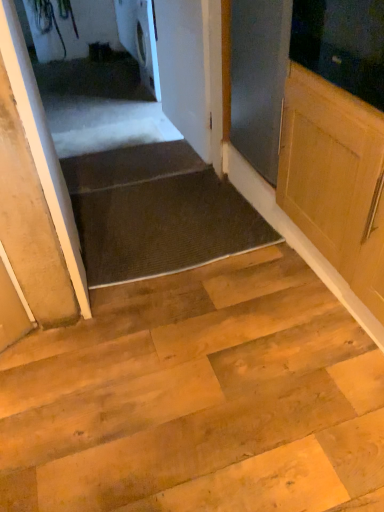
Find the location of a particular element. This screenshot has width=384, height=512. white glossy washing machine at upper center is located at coordinates (140, 39).

This screenshot has height=512, width=384. What do you see at coordinates (185, 69) in the screenshot?
I see `white matte door at upper center, the 2th door in the left-to-right sequence` at bounding box center [185, 69].

Measure the distance between point (120, 199) and camera.

Point (120, 199) is 8.02 feet from camera.

Find the location of `white glossy washing machine at upper center`. white glossy washing machine at upper center is located at coordinates [140, 39].

In the scene shown: Which is closer to the camera, (x=173, y=103) or (x=104, y=169)?

The point (x=104, y=169) is closer.

Between white matte door at upper center, the 2th door in the left-to-right sequence, and dark brown carpet at lower center, which one appears on the right side from the viewer's perspective?

From the viewer's perspective, white matte door at upper center, the 2th door in the left-to-right sequence, appears more on the right side.

Looking at this image, is white matte door at upper center, the 2th door in the left-to-right sequence, in contact with dark brown carpet at lower center?

No, white matte door at upper center, the 2th door in the left-to-right sequence, is not beside dark brown carpet at lower center.

From a real-world perspective, which is physically above, white matte door at upper center, the 2th door in the left-to-right sequence, or dark brown carpet at lower center?

white matte door at upper center, the 2th door in the left-to-right sequence, is physically above.

From the image's perspective, between dark gray textured mat at center and white matte door at left, acting as the 1th door starting from the front, which one is located above?

From the image's view, white matte door at left, acting as the 1th door starting from the front, is above.

Between dark gray textured mat at center and white matte door at left, which is the 1th door in left-to-right order, which one has larger width?

white matte door at left, which is the 1th door in left-to-right order.

From a real-world perspective, is dark gray textured mat at center on white matte door at left, acting as the 1th door starting from the front?

No, from a real-world perspective, dark gray textured mat at center is not above white matte door at left, acting as the 1th door starting from the front.

Is white glossy washing machine at upper center aimed at white matte door at upper center, which is the first door in right-to-left order?

No, white glossy washing machine at upper center does not turn towards white matte door at upper center, which is the first door in right-to-left order.

At what (x,y) coordinates should I click in order to perform the action: click on the 1st door directly above the white glossy washing machine at upper center (from a real-world perspective). Please return your answer as a coordinate pair (x, y). Looking at the image, I should click on (185, 69).

Considering the sizes of objects white glossy washing machine at upper center and white matte door at upper center, the first door positioned from the back, in the image provided, who is smaller, white glossy washing machine at upper center or white matte door at upper center, the first door positioned from the back,?

white matte door at upper center, the first door positioned from the back, is smaller.

Is point (119, 17) positioned behind point (159, 3)?

Yes, point (119, 17) is farther from viewer.

Which object is further away from the camera taking this photo, white matte door at upper center, which is the first door in right-to-left order, or white matte door at left, which is the 1th door in left-to-right order?

Positioned behind is white matte door at upper center, which is the first door in right-to-left order.

Which is more to the right, white matte door at upper center, the first door positioned from the back, or white matte door at left, positioned as the second door in back-to-front order?

From the viewer's perspective, white matte door at upper center, the first door positioned from the back, appears more on the right side.

What's the angular difference between white matte door at upper center, the first door positioned from the back, and white matte door at left, positioned as the second door in back-to-front order,'s facing directions?

The angular difference between white matte door at upper center, the first door positioned from the back, and white matte door at left, positioned as the second door in back-to-front order, is 85.6 degrees.

From the picture: How much distance is there between white matte door at upper center, which is the first door in right-to-left order, and white matte door at left, acting as the 1th door starting from the front?

white matte door at upper center, which is the first door in right-to-left order, and white matte door at left, acting as the 1th door starting from the front, are 1.33 meters apart.

Which object is positioned more to the right, white glossy washing machine at upper center or dark brown carpet at lower center?

white glossy washing machine at upper center is more to the right.

Consider the image. From the image's perspective, is white glossy washing machine at upper center above or below dark brown carpet at lower center?

From the image's perspective, white glossy washing machine at upper center appears above dark brown carpet at lower center.

Is white glossy washing machine at upper center inside or outside of dark brown carpet at lower center?

white glossy washing machine at upper center is spatially situated outside dark brown carpet at lower center.

From a real-world perspective, is white glossy washing machine at upper center physically below dark brown carpet at lower center?

No, from a real-world perspective, white glossy washing machine at upper center is not under dark brown carpet at lower center.

Which of these two, white matte door at left, acting as the 1th door starting from the front, or white glossy washing machine at upper center, is smaller?

With smaller size is white matte door at left, acting as the 1th door starting from the front.

In the image, there is a white matte door at left, the 2th door positioned from the right. Where is `appliance below it (from a real-world perspective)`? This screenshot has height=512, width=384. appliance below it (from a real-world perspective) is located at coordinates (140, 39).

From the picture: From a real-world perspective, which is physically below, white matte door at left, positioned as the second door in back-to-front order, or white glossy washing machine at upper center?

From a 3D spatial view, white glossy washing machine at upper center is below.

Considering the relative sizes of white matte door at left, positioned as the second door in back-to-front order, and white glossy washing machine at upper center in the image provided, is white matte door at left, positioned as the second door in back-to-front order, wider than white glossy washing machine at upper center?

Correct, the width of white matte door at left, positioned as the second door in back-to-front order, exceeds that of white glossy washing machine at upper center.

Based on their positions, is white matte door at left, which is the 1th door in left-to-right order, located to the left or right of dark gray textured mat at center?

white matte door at left, which is the 1th door in left-to-right order, is positioned on dark gray textured mat at center's left side.

From a real-world perspective, which door is the 2nd one above the dark gray textured mat at center? Please provide its 2D coordinates.

[(35, 191)]

From the picture: Is white matte door at left, acting as the 1th door starting from the front, in front of or behind dark gray textured mat at center in the image?

white matte door at left, acting as the 1th door starting from the front, is positioned closer to the viewer than dark gray textured mat at center.

At what (x,y) coordinates should I click in order to perform the action: click on the 1st door in front of the dark brown carpet at lower center, starting your count from the anchor. Please return your answer as a coordinate pair (x, y). This screenshot has width=384, height=512. Looking at the image, I should click on (185, 69).

Find the location of `stairwell behind the white matte door at left, the 2th door positioned from the right`. stairwell behind the white matte door at left, the 2th door positioned from the right is located at coordinates (156, 212).

Based on their spatial positions, is dark brown carpet at lower center or white glossy washing machine at upper center further from white matte door at left, positioned as the second door in back-to-front order?

white glossy washing machine at upper center lies further to white matte door at left, positioned as the second door in back-to-front order, than the other object.

From the image, which object appears to be farther from dark brown carpet at lower center, white glossy washing machine at upper center or white matte door at upper center, the first door positioned from the back?

Among the two, white glossy washing machine at upper center is located further to dark brown carpet at lower center.

In the scene shown: Estimate the real-world distances between objects in this image. Which object is closer to dark brown carpet at lower center, white glossy washing machine at upper center or dark gray textured mat at center?

Among the two, dark gray textured mat at center is located nearer to dark brown carpet at lower center.

Estimate the real-world distances between objects in this image. Which object is further from dark gray textured mat at center, white matte door at upper center, the 2th door in the left-to-right sequence, or dark brown carpet at lower center?

white matte door at upper center, the 2th door in the left-to-right sequence, is positioned further to the anchor dark gray textured mat at center.

From the picture: Considering their positions, is white matte door at upper center, placed as the 2th door when sorted from front to back, positioned further to white glossy washing machine at upper center than dark brown carpet at lower center?

Among the two, dark brown carpet at lower center is located further to white glossy washing machine at upper center.

Considering their positions, is dark brown carpet at lower center positioned closer to white glossy washing machine at upper center than white matte door at upper center, the first door positioned from the back?

white matte door at upper center, the first door positioned from the back.

When comparing their distances from white matte door at left, which is the 1th door in left-to-right order, does dark brown carpet at lower center or dark gray textured mat at center seem further?

dark brown carpet at lower center is positioned further to the anchor white matte door at left, which is the 1th door in left-to-right order.

Looking at this image, when comparing their distances from white matte door at upper center, which is the first door in right-to-left order, does white glossy washing machine at upper center or dark gray textured mat at center seem further?

white glossy washing machine at upper center.

Where is `stairs positioned between white matte door at left, which is the 1th door in left-to-right order, and white glossy washing machine at upper center from near to far`? Image resolution: width=384 pixels, height=512 pixels. stairs positioned between white matte door at left, which is the 1th door in left-to-right order, and white glossy washing machine at upper center from near to far is located at coordinates (129, 166).

Where is `stairs positioned between white matte door at upper center, the 2th door in the left-to-right sequence, and white glossy washing machine at upper center from near to far`? stairs positioned between white matte door at upper center, the 2th door in the left-to-right sequence, and white glossy washing machine at upper center from near to far is located at coordinates (129, 166).

The width and height of the screenshot is (384, 512). I want to click on stairs between white glossy washing machine at upper center and dark gray textured mat at center vertically, so click(x=129, y=166).

Identify the location of stairwell located between white matte door at left, the 2th door positioned from the right, and white matte door at upper center, which is the first door in right-to-left order, in the depth direction. (156, 212).